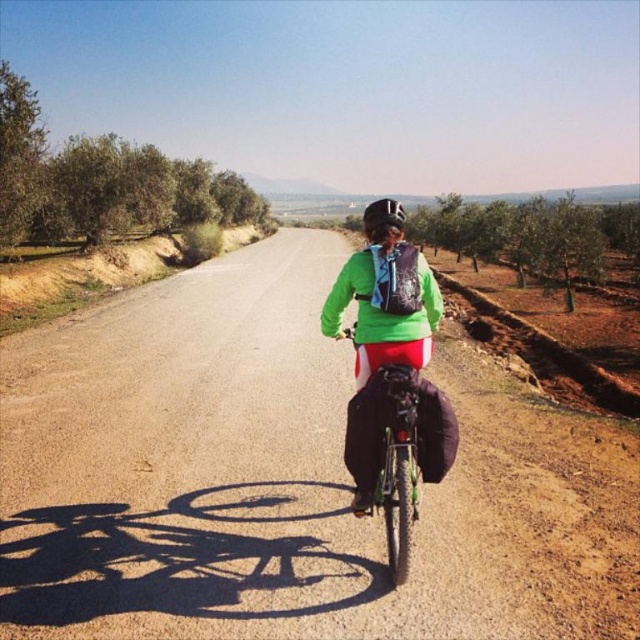
You are a cyclist planning to ride along the brown gravel road at center while wearing the green matte jacket at center. Based on the road width, can you safely ride while wearing the jacket?

The brown gravel road at center might be wider than green matte jacket at center, so it is likely safe to ride while wearing the jacket as the road width should accommodate the cyclist comfortably.

You are a delivery drone operator. Your drone has a wingspan of 2 meters. You need to fly it through the gap between the brown gravel road at center and the green matte bicycle at center. Can the drone safely pass through the gap without touching either side?

The gap between the brown gravel road at center and the green matte bicycle at center is 2.50 meters. Since the drone has a wingspan of 2 meters, it can safely pass through the gap as the width is sufficient to accommodate the drone without touching either side.

You are a drone operator trying to capture a photo of the cyclist. The drone is currently at a position above the brown gravel road at center. To ensure the cyclist is centered in the photo, should you move the drone north or south? Please explain your reasoning based on the road position.

The brown gravel road at center is located at coordinates 0.750 on the x and 0.448 on the y. Since the cyclist is positioned centrally in the frame, the drone should move north to align with the cyclist. The road is at the center, so moving north would adjust the drone to the cyclist.